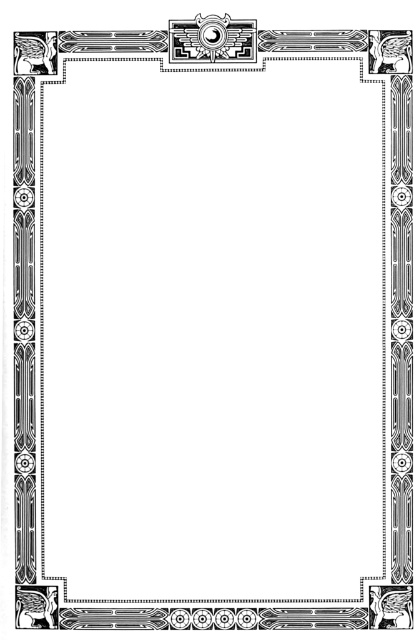
Does point (390, 600) lie in front of point (199, 20)?

Yes.

Which is in front, point (408, 593) or point (217, 36)?

Point (408, 593)

Does point (403, 627) lie in front of point (227, 35)?

Yes, point (403, 627) is in front of point (227, 35).

The image size is (419, 640). I want to click on matte black square at bottom right, so click(390, 605).